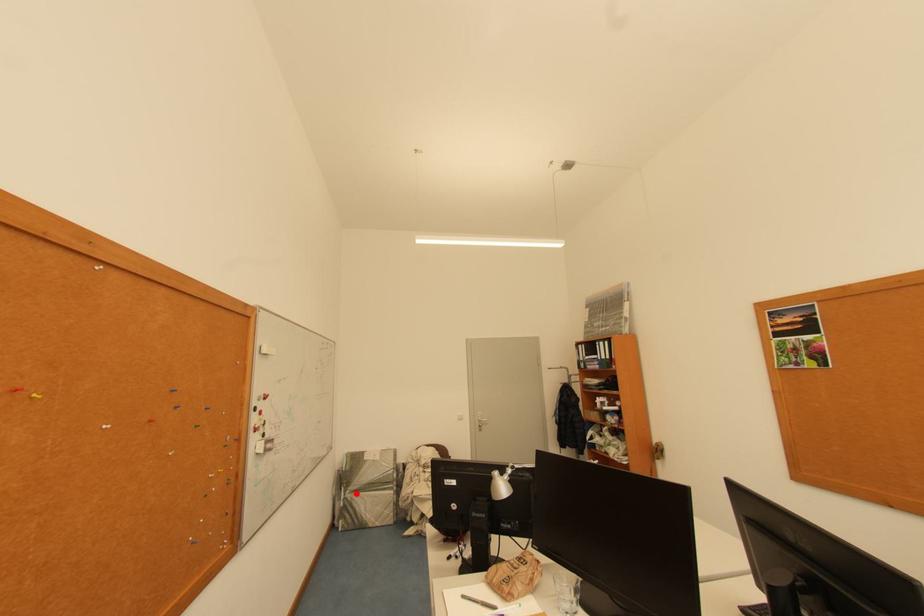
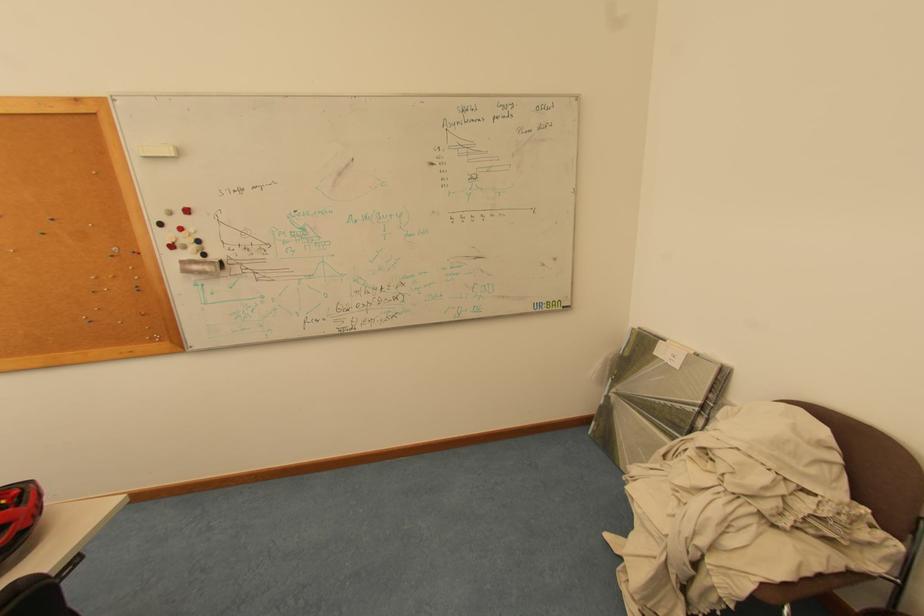
Question: I am providing you with two images of the same scene from different viewpoints. In image1, a red point is highlighted. Considering the same 3D point in image2, which of the following is correct?

Choices:
 (A) It is closer
 (B) It is farther

Answer: (A)